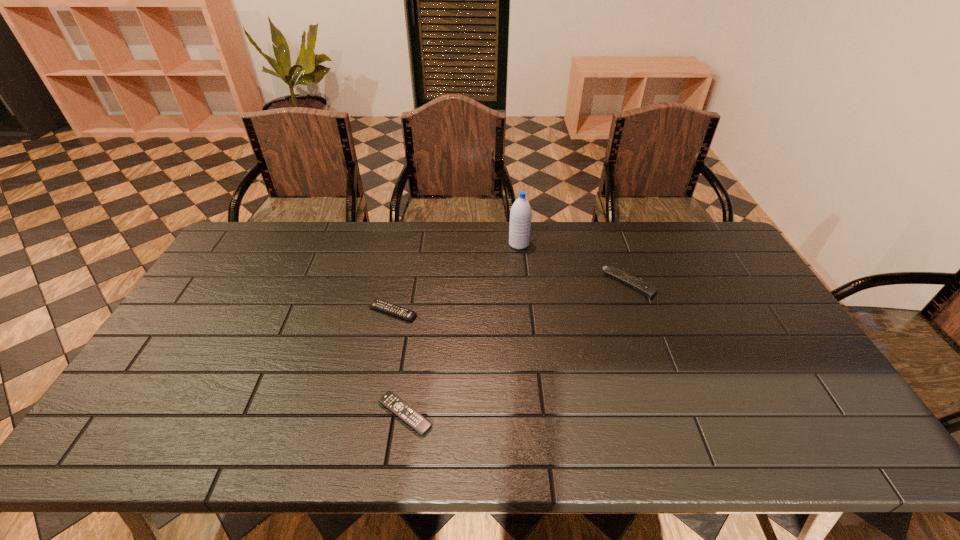
The image size is (960, 540). I want to click on remote control that is the second closest to the second farthest remote control, so click(x=649, y=291).

Find the location of a particular element. The image size is (960, 540). free space that satisfies the following two spatial constraints: 1. on the back side of the third shortest object; 2. on the left side of the nearest remote control is located at coordinates (423, 284).

Image resolution: width=960 pixels, height=540 pixels. In order to click on vacant region that satisfies the following two spatial constraints: 1. on the front side of the farthest remote control; 2. on the left side of the tallest object in this screenshot , I will do `click(523, 284)`.

What are the coordinates of `free space in the image that satisfies the following two spatial constraints: 1. on the back side of the second nearest object; 2. on the right side of the rightmost remote control` in the screenshot? It's located at [398, 284].

Locate an element on the screen. The image size is (960, 540). blank space that satisfies the following two spatial constraints: 1. on the back side of the third nearest object; 2. on the right side of the nearest remote control is located at coordinates (423, 284).